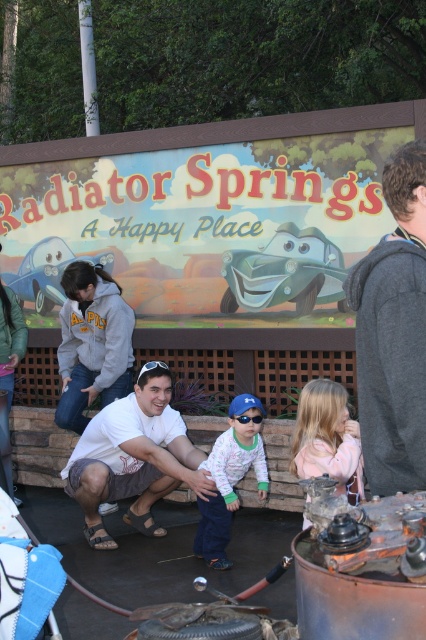
You are a photographer trying to capture a group photo of the dark gray sweater at upper right and the white fleece jacket at center. Which of the two should you position to the left to ensure they are both in frame?

The white fleece jacket at center should be positioned to the left because the dark gray sweater at upper right is already on the right side of it, so moving the white fleece jacket to the left would align them properly within the frame.

You are a photographer trying to capture a group photo of the white matte shirt at center and the white fleece jacket at center. If you want to ensure both subjects are fully visible in the frame, which subject should you position closer to the camera to avoid cropping?

The white fleece jacket at center should be positioned closer to the camera because it might be narrower than the white matte shirt at center, allowing more space for both subjects to fit without cropping.